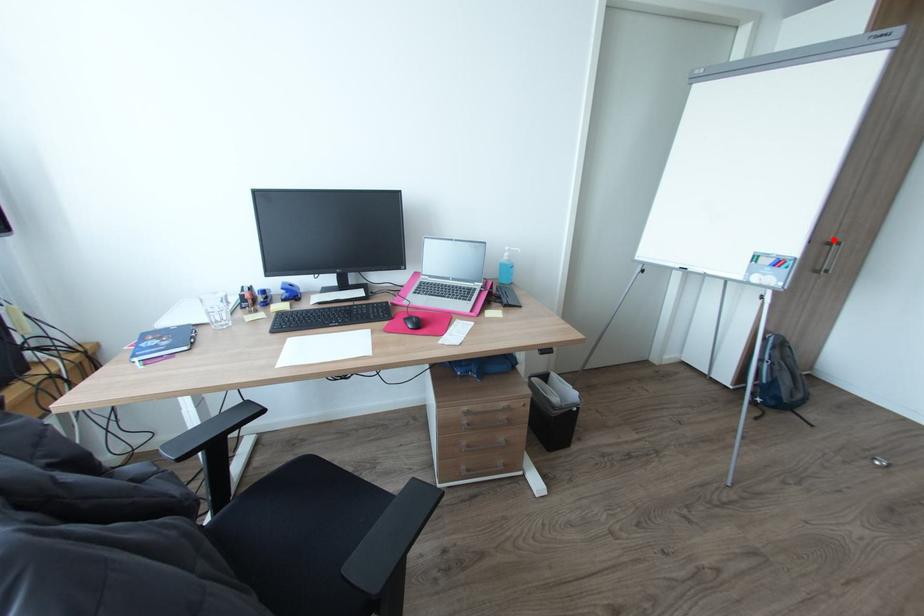
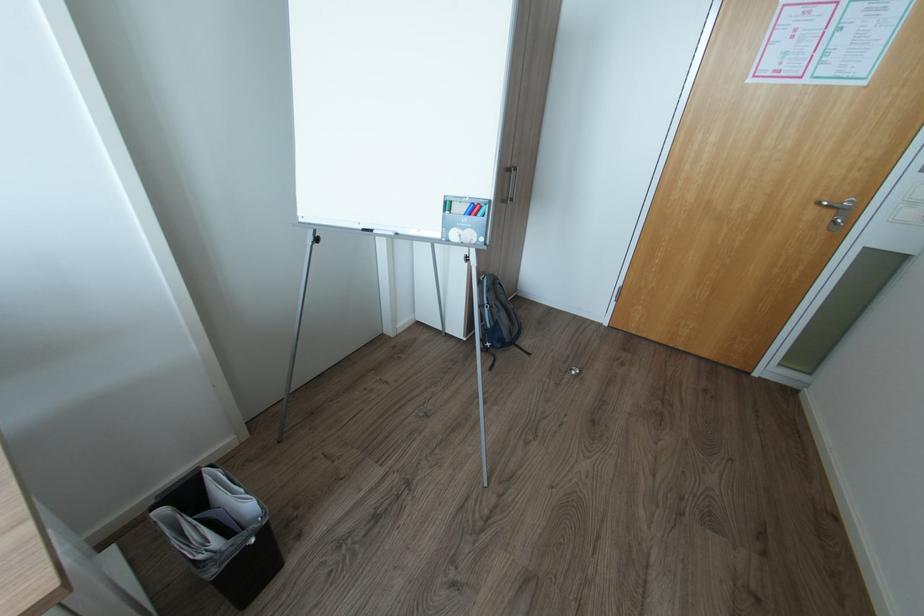
Question: I am providing you with two images of the same scene from different viewpoints. A red point is marked on the first image. Can you still see the location of the red point in image 2?

Choices:
 (A) Yes
 (B) No

Answer: (A)